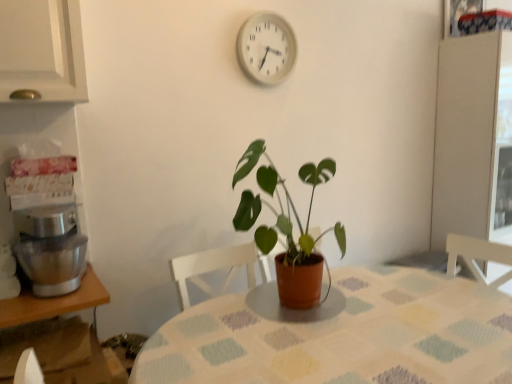
Question: Is wooden table at lower left, which appears as the 1th table when viewed from the left, next to textured fabric table at center, placed as the second table when sorted from left to right, and touching it?

Choices:
 (A) no
 (B) yes

Answer: (A)

Question: Is wooden table at lower left, placed as the 2th table when sorted from right to left, in front of textured fabric table at center, which appears as the first table when viewed from the right?

Choices:
 (A) yes
 (B) no

Answer: (B)

Question: From a real-world perspective, is wooden table at lower left, placed as the 2th table when sorted from right to left, on textured fabric table at center, which appears as the first table when viewed from the right?

Choices:
 (A) no
 (B) yes

Answer: (B)

Question: Considering the relative sizes of wooden table at lower left, which appears as the 1th table when viewed from the left, and textured fabric table at center, placed as the second table when sorted from left to right, in the image provided, is wooden table at lower left, which appears as the 1th table when viewed from the left, smaller than textured fabric table at center, placed as the second table when sorted from left to right,?

Choices:
 (A) yes
 (B) no

Answer: (A)

Question: Can you confirm if wooden table at lower left, placed as the 2th table when sorted from right to left, is bigger than textured fabric table at center, which appears as the first table when viewed from the right?

Choices:
 (A) yes
 (B) no

Answer: (B)

Question: Would you say wooden table at lower left, which appears as the 1th table when viewed from the left, is inside or outside textured fabric table at center, placed as the second table when sorted from left to right?

Choices:
 (A) outside
 (B) inside

Answer: (A)

Question: Considering the positions of wooden table at lower left, which appears as the 1th table when viewed from the left, and textured fabric table at center, which appears as the first table when viewed from the right, in the image, is wooden table at lower left, which appears as the 1th table when viewed from the left, taller or shorter than textured fabric table at center, which appears as the first table when viewed from the right,?

Choices:
 (A) tall
 (B) short

Answer: (B)

Question: Considering the positions of wooden table at lower left, placed as the 2th table when sorted from right to left, and textured fabric table at center, which appears as the first table when viewed from the right, in the image, is wooden table at lower left, placed as the 2th table when sorted from right to left, wider or thinner than textured fabric table at center, which appears as the first table when viewed from the right,?

Choices:
 (A) wide
 (B) thin

Answer: (B)

Question: Based on their sizes in the image, would you say wooden table at lower left, placed as the 2th table when sorted from right to left, is bigger or smaller than textured fabric table at center, placed as the second table when sorted from left to right?

Choices:
 (A) small
 (B) big

Answer: (A)

Question: Would you say silver metallic mixer at left is inside or outside white plastic clock at upper center?

Choices:
 (A) inside
 (B) outside

Answer: (B)

Question: Considering the relative positions of silver metallic mixer at left and white plastic clock at upper center in the image provided, is silver metallic mixer at left to the left or to the right of white plastic clock at upper center?

Choices:
 (A) right
 (B) left

Answer: (B)

Question: From a real-world perspective, is silver metallic mixer at left above or below white plastic clock at upper center?

Choices:
 (A) above
 (B) below

Answer: (B)

Question: Looking at the image, does silver metallic mixer at left seem bigger or smaller compared to white plastic clock at upper center?

Choices:
 (A) small
 (B) big

Answer: (B)

Question: Is point (35, 312) closer or farther from the camera than point (344, 231)?

Choices:
 (A) closer
 (B) farther

Answer: (A)

Question: Visually, is wooden table at lower left, which appears as the 1th table when viewed from the left, positioned to the left or to the right of green matte plant at center?

Choices:
 (A) right
 (B) left

Answer: (B)